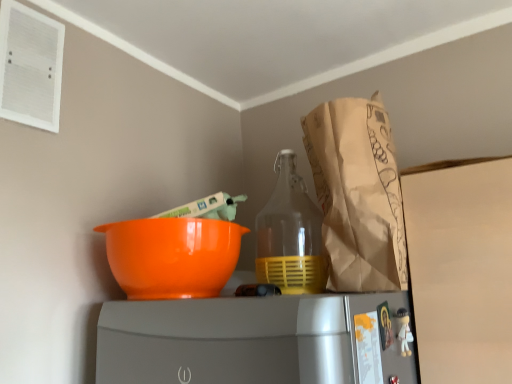
What do you see at coordinates (404, 331) in the screenshot? I see `white matte figurine at lower right` at bounding box center [404, 331].

Image resolution: width=512 pixels, height=384 pixels. Find the location of `white matte figurine at lower right`. white matte figurine at lower right is located at coordinates (404, 331).

What is the approximate height of white matte figurine at lower right?

It is 10.17 centimeters.

Identify the location of white matte figurine at lower right. This screenshot has height=384, width=512. (404, 331).